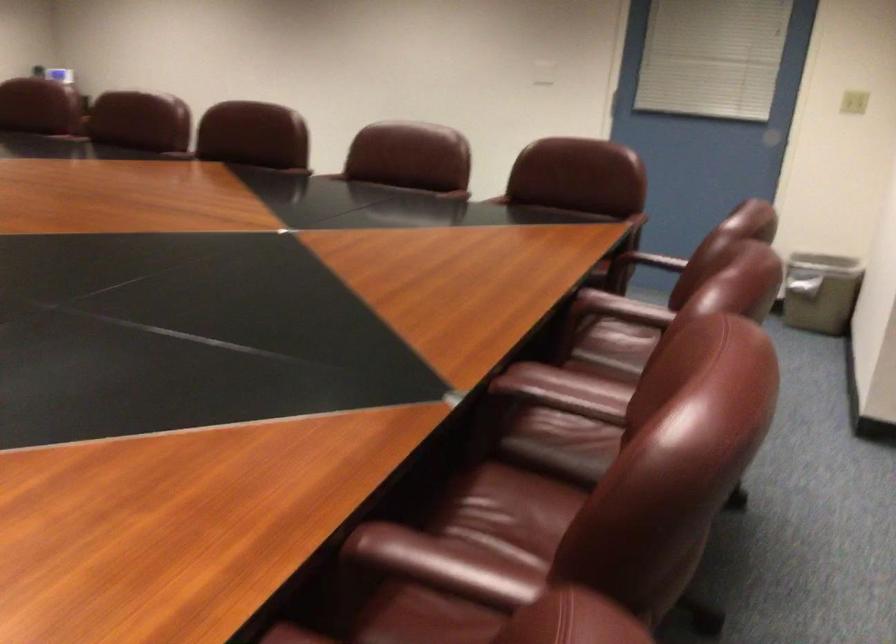
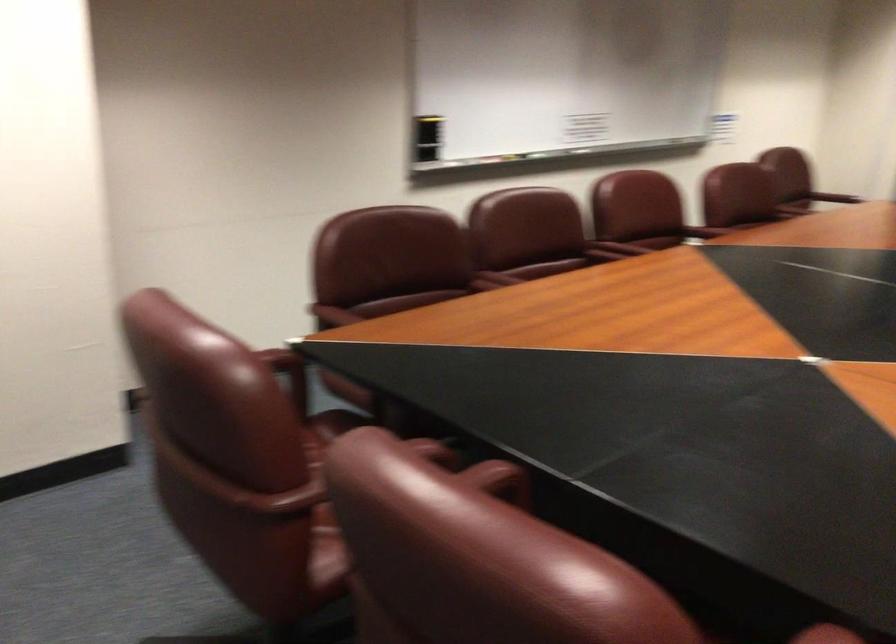
Where in the second image is the point corresponding to point 459,185 from the first image?

(495, 478)